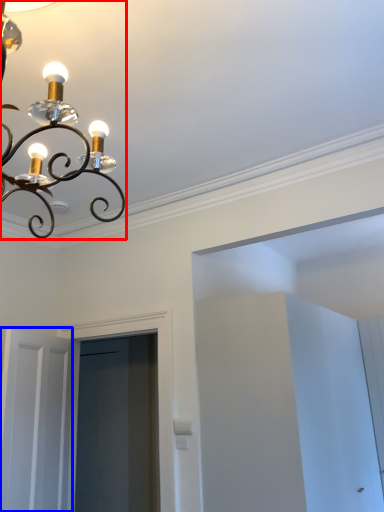
Question: Which object is closer to the camera taking this photo, lamp (highlighted by a red box) or door (highlighted by a blue box)?

Choices:
 (A) lamp
 (B) door

Answer: (A)